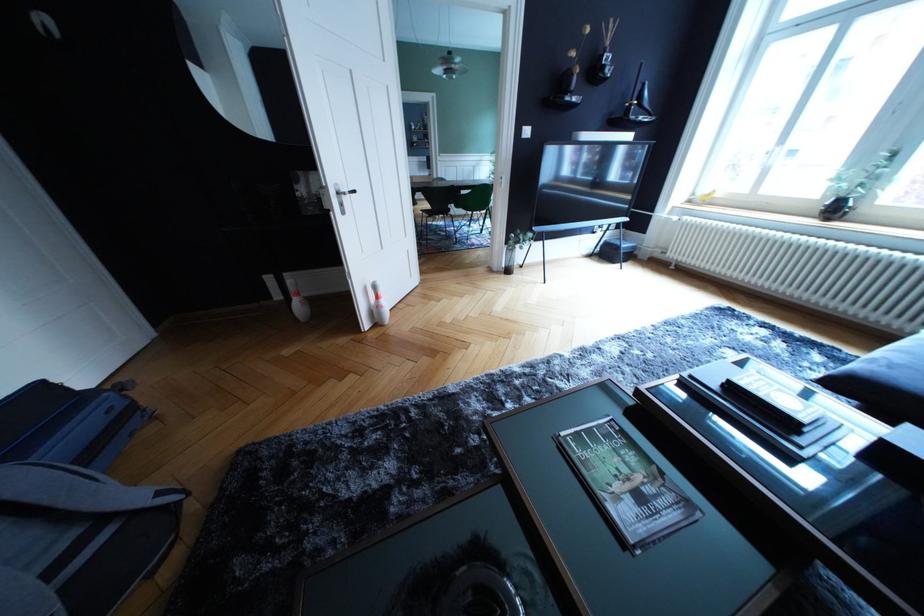
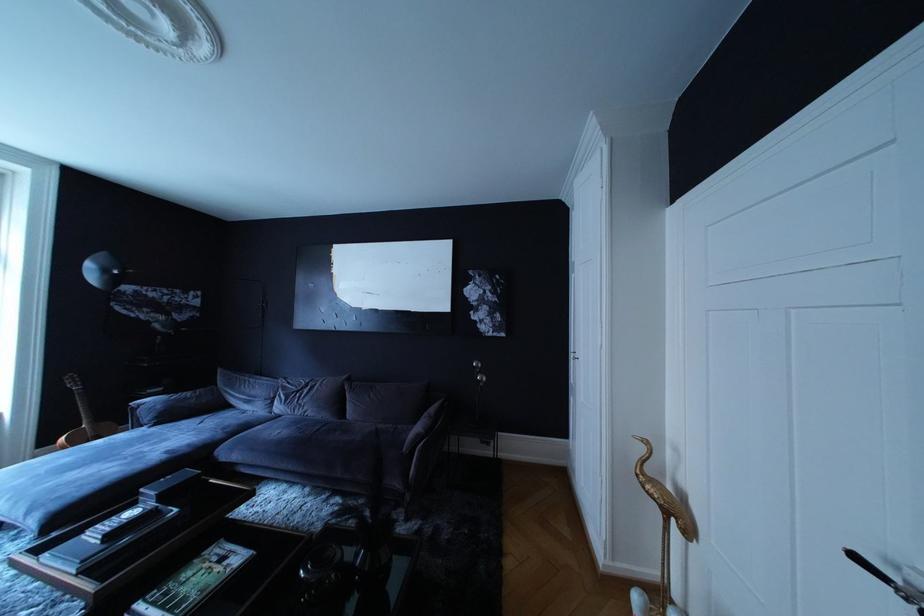
Where in the second image is the point corresponding to pixel 649 504 from the first image?

(232, 565)